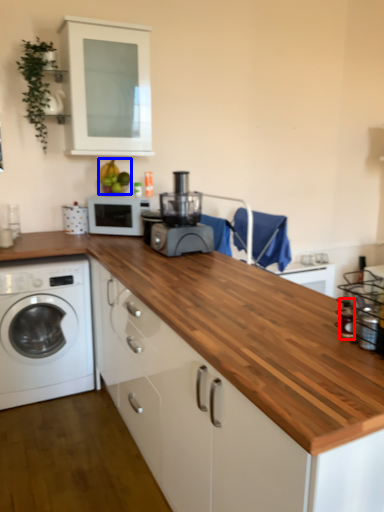
Question: Which object is closer to the camera taking this photo, bottle (highlighted by a red box) or fruit (highlighted by a blue box)?

Choices:
 (A) bottle
 (B) fruit

Answer: (A)